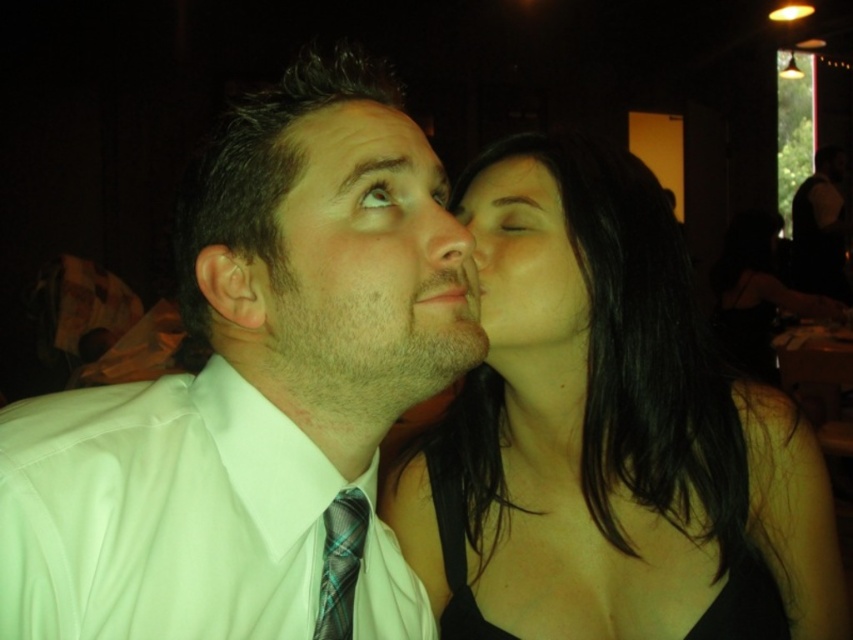
Question: Is white satin shirt at center wider than smooth skin nose at center?

Choices:
 (A) no
 (B) yes

Answer: (B)

Question: Which point is farther to the camera?

Choices:
 (A) (558, 259)
 (B) (334, 557)

Answer: (A)

Question: Is black satin dress at center closer to camera compared to smooth skin face at center?

Choices:
 (A) no
 (B) yes

Answer: (B)

Question: Can you confirm if matte skin forehead at upper center is wider than smooth skin nose at center?

Choices:
 (A) yes
 (B) no

Answer: (A)

Question: Estimate the real-world distances between objects in this image. Which object is closer to the smooth skin nose at center?

Choices:
 (A) matte skin forehead at upper center
 (B) smooth skin face at center

Answer: (A)

Question: Which object is the closest to the matte skin forehead at upper center?

Choices:
 (A) white satin shirt at center
 (B) smooth skin nose at center

Answer: (B)